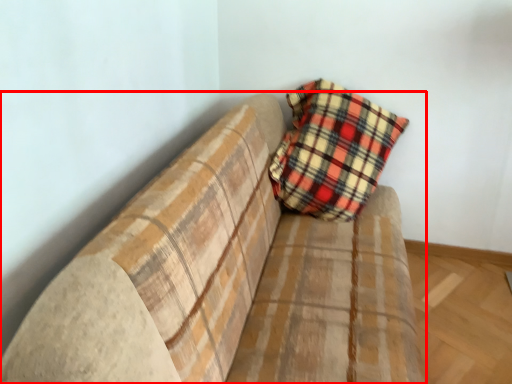
Question: From the image's perspective, what is the correct spatial positioning of studio couch (annotated by the red box) in reference to pillow?

Choices:
 (A) below
 (B) above

Answer: (A)